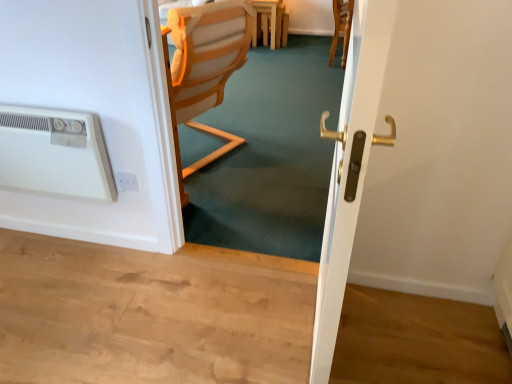
At what (x,y) coordinates should I click in order to perform the action: click on vacant area that lies to the right of white glossy door handle at center. Please return your answer as a coordinate pair (x, y). The width and height of the screenshot is (512, 384). Looking at the image, I should click on (400, 336).